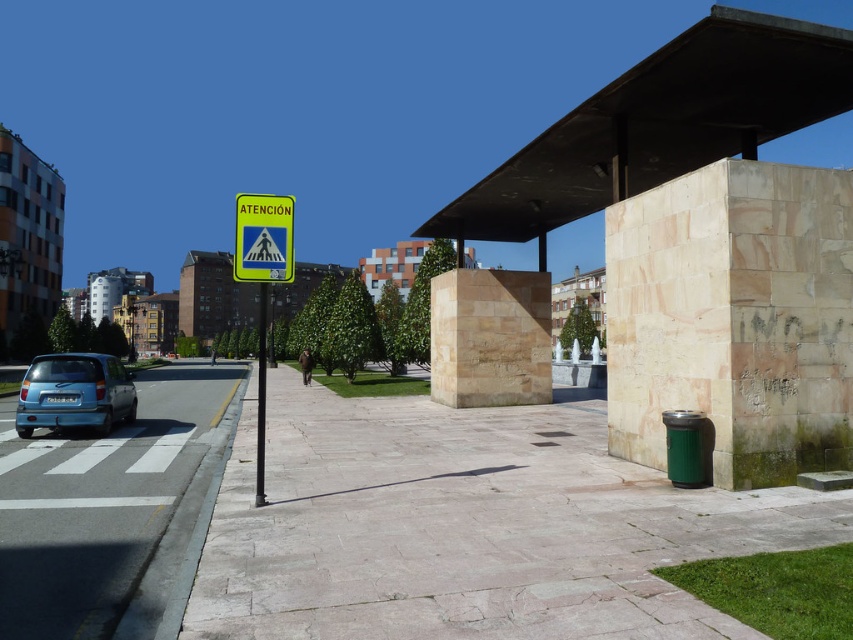
You are standing at the point with coordinates 0.700, 0.500 in the image. You want to walk to the pink stone pavement at center. In which direction should you move?

You should move northeast to reach the pink stone pavement at center because it is located at coordinates (468, 528), which is northeast of your current position at (426, 448).

You are a delivery person approaching the gray concrete pavement at lower left and the yellow plastic sign at left. Which object is closer to the ground?

The gray concrete pavement at lower left is located below the yellow plastic sign at left, so it is closer to the ground.